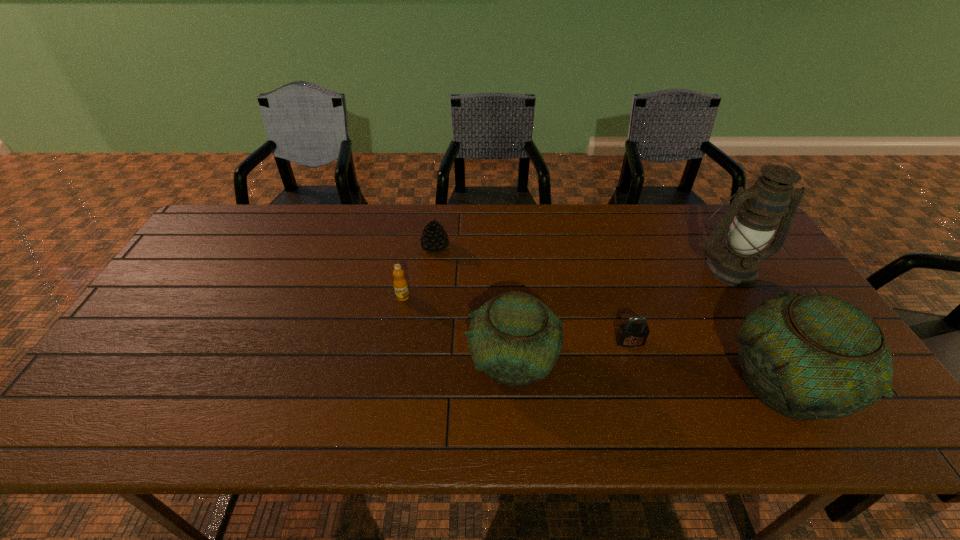
Identify the location of the fourth shortest object. (514, 338).

Where is `the left pottery`? the left pottery is located at coordinates (514, 338).

At what (x,y) coordinates should I click in order to perform the action: click on the fifth shortest object. Please return your answer as a coordinate pair (x, y). Looking at the image, I should click on (812, 356).

Locate an element on the screen. The width and height of the screenshot is (960, 540). the right pottery is located at coordinates (812, 356).

This screenshot has width=960, height=540. Find the location of `oil lamp`. oil lamp is located at coordinates (758, 209).

You are a GUI agent. You are given a task and a screenshot of the screen. Output one action in this format:
    pyautogui.click(x=<x>, y=<y>)
    Task: Click on the pinecone
    
    Given the screenshot: What is the action you would take?
    pyautogui.click(x=434, y=239)

Image resolution: width=960 pixels, height=540 pixels. I want to click on the third farthest object, so click(x=400, y=283).

Identify the location of the leftmost object. The height and width of the screenshot is (540, 960). (x=400, y=283).

You are a GUI agent. You are given a task and a screenshot of the screen. Output one action in this format:
    pyautogui.click(x=<x>, y=<y>)
    Task: Click on the padlock
    
    Given the screenshot: What is the action you would take?
    pyautogui.click(x=630, y=334)

This screenshot has width=960, height=540. Identify the location of vacant space situated 0.150m on the left of the third tallest object. (405, 361).